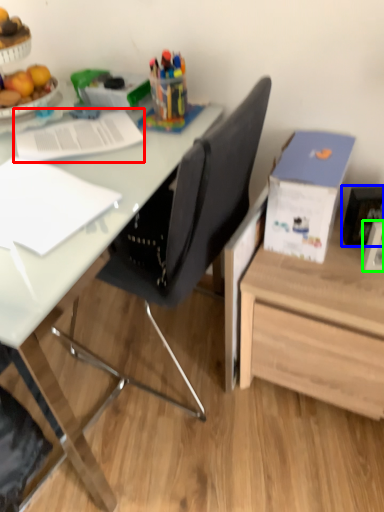
Question: Which object is the closest to the notebook (highlighted by a red box)? Choose among these: picture frame (highlighted by a blue box) or picture frame (highlighted by a green box).

Choices:
 (A) picture frame
 (B) picture frame

Answer: (A)